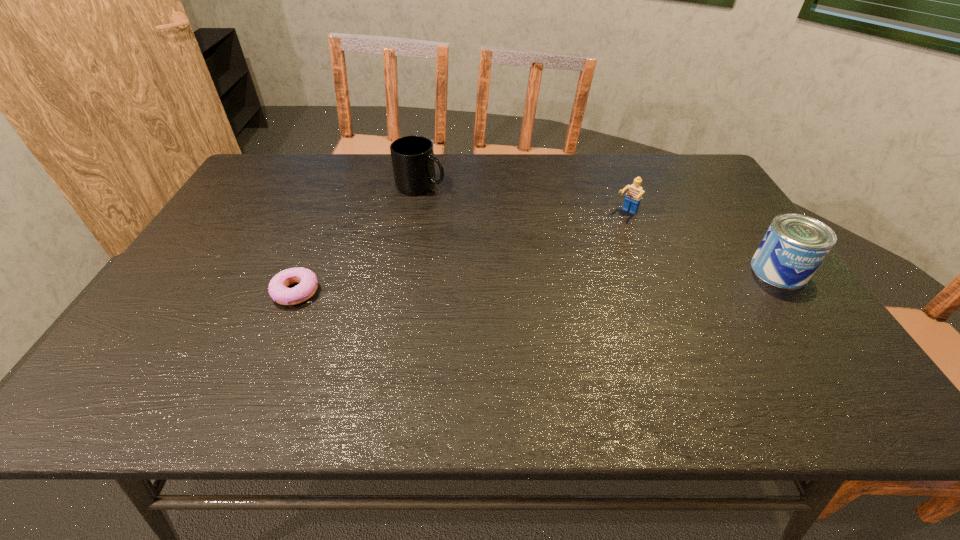
At what (x,y) coordinates should I click in order to perform the action: click on vacant space located on the face of the third tallest object. Please return your answer as a coordinate pair (x, y). Looking at the image, I should click on (609, 231).

I want to click on vacant position located with the handle on the side of the second object from left to right, so click(471, 210).

I want to click on vacant area situated with the handle on the side of the second object from left to right, so click(x=452, y=200).

I want to click on vacant area located 0.190m with the handle on the side of the second object from left to right, so click(x=484, y=217).

At what (x,y) coordinates should I click in order to perform the action: click on object present at the far edge. Please return your answer as a coordinate pair (x, y). This screenshot has height=540, width=960. Looking at the image, I should click on (413, 161).

Locate an element on the screen. The width and height of the screenshot is (960, 540). object positioned at the right edge is located at coordinates (794, 246).

Find the location of a particular element. vacant region at the far edge of the desktop is located at coordinates (536, 186).

Identify the location of vacant space at the near edge of the desktop. (454, 341).

In the image, there is a desktop. Identify the location of vacant space at the left edge. (204, 309).

Locate an element on the screen. The width and height of the screenshot is (960, 540). vacant space at the far right corner of the desktop is located at coordinates (689, 154).